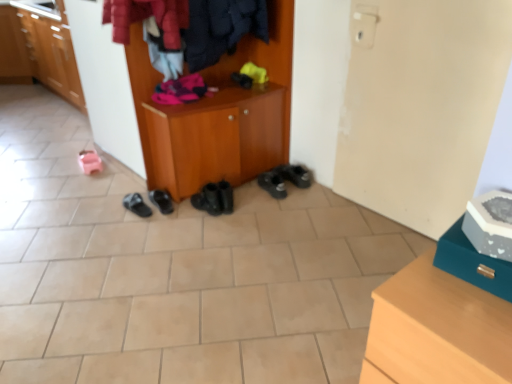
What are the coordinates of `vacant region under black rubber shoes at center, the second footwear in the right-to-left sequence (from a real-world perspective)` in the screenshot? It's located at (274, 194).